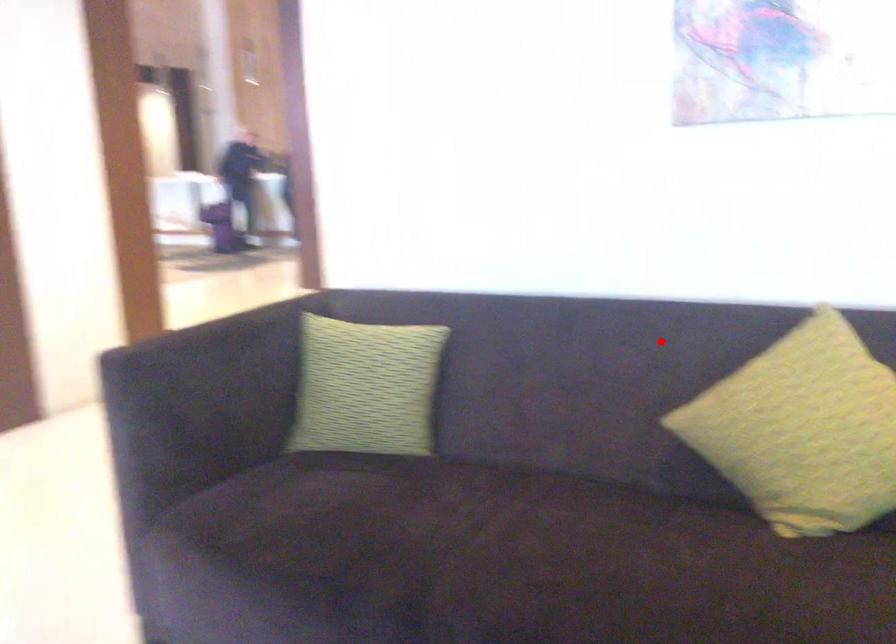
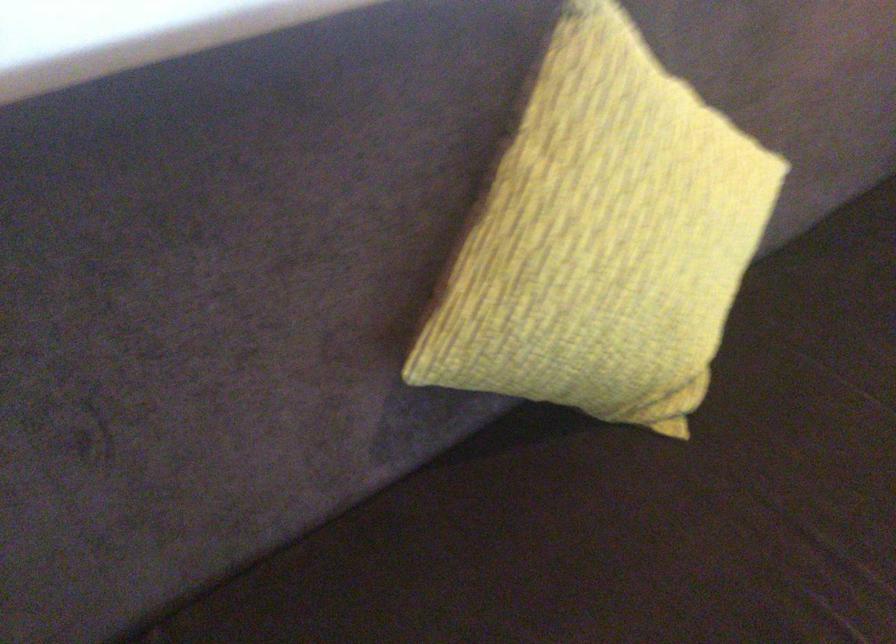
In the second image, find the point that corresponds to the highlighted location in the first image.

(231, 210)